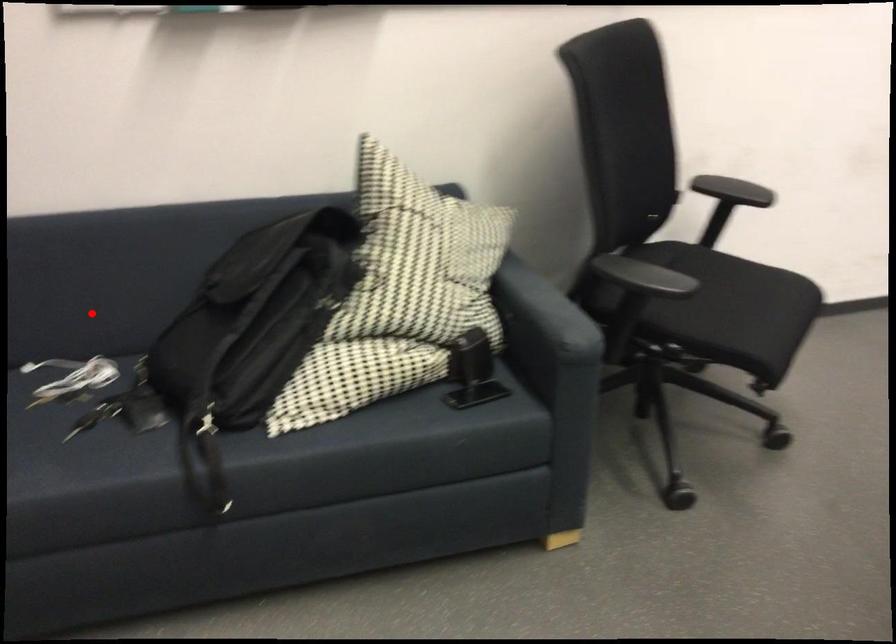
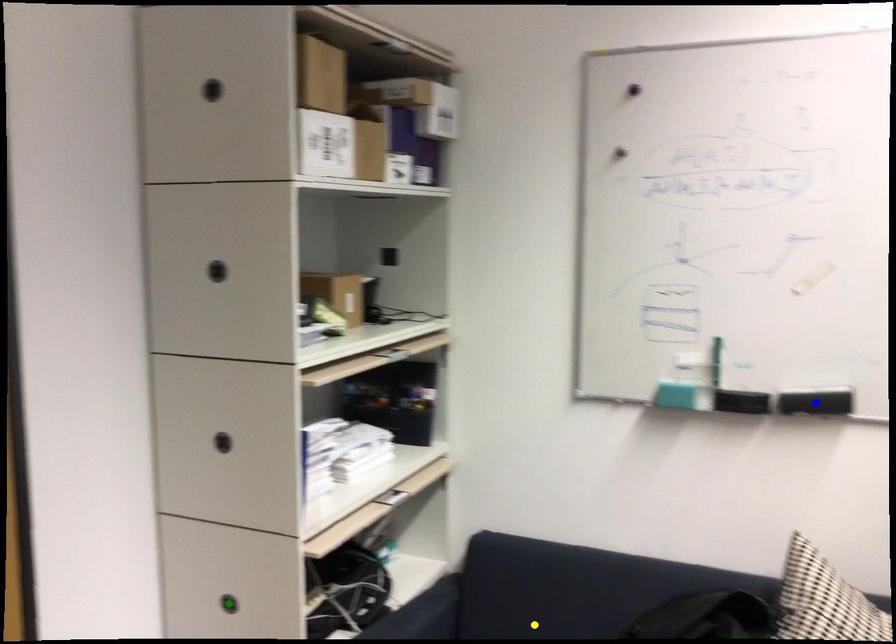
Question: I am providing you with two images of the same scene from different viewpoints. A red point is marked on the first image. You are given multiple points on the second image. Which spot in image 2 lines up with the point in image 1?

Choices:
 (A) yellow point
 (B) green point
 (C) blue point

Answer: (A)